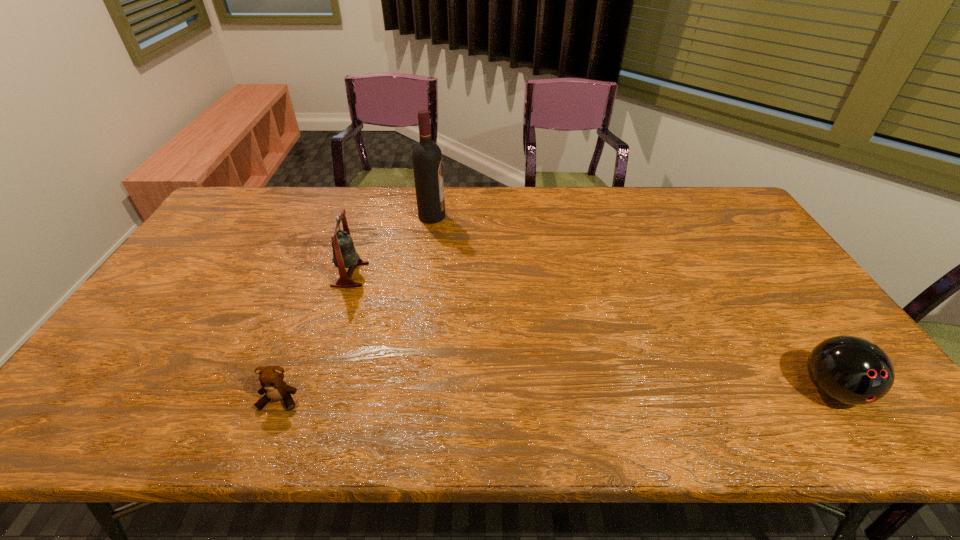
Where is `bowling ball that is positioned at the near edge`? bowling ball that is positioned at the near edge is located at coordinates (851, 370).

This screenshot has width=960, height=540. In order to click on teddy bear located at the near edge in this screenshot , I will do `click(271, 378)`.

This screenshot has width=960, height=540. I want to click on object present at the right edge, so click(x=851, y=370).

At what (x,y) coordinates should I click in order to perform the action: click on object that is at the near right corner. Please return your answer as a coordinate pair (x, y). Looking at the image, I should click on (851, 370).

This screenshot has width=960, height=540. In order to click on free space at the far edge of the desktop in this screenshot , I will do `click(591, 213)`.

I want to click on vacant space at the near edge, so click(182, 418).

At what (x,y) coordinates should I click in order to perform the action: click on blank space at the left edge. Please return your answer as a coordinate pair (x, y). This screenshot has width=960, height=540. Looking at the image, I should click on (206, 298).

At what (x,y) coordinates should I click in order to perform the action: click on blank space at the far left corner. Please return your answer as a coordinate pair (x, y). This screenshot has height=540, width=960. Looking at the image, I should click on (244, 188).

In the image, there is a desktop. Where is `vacant area at the far right corner`? vacant area at the far right corner is located at coordinates (701, 206).

I want to click on vacant space at the near right corner of the desktop, so click(x=886, y=407).